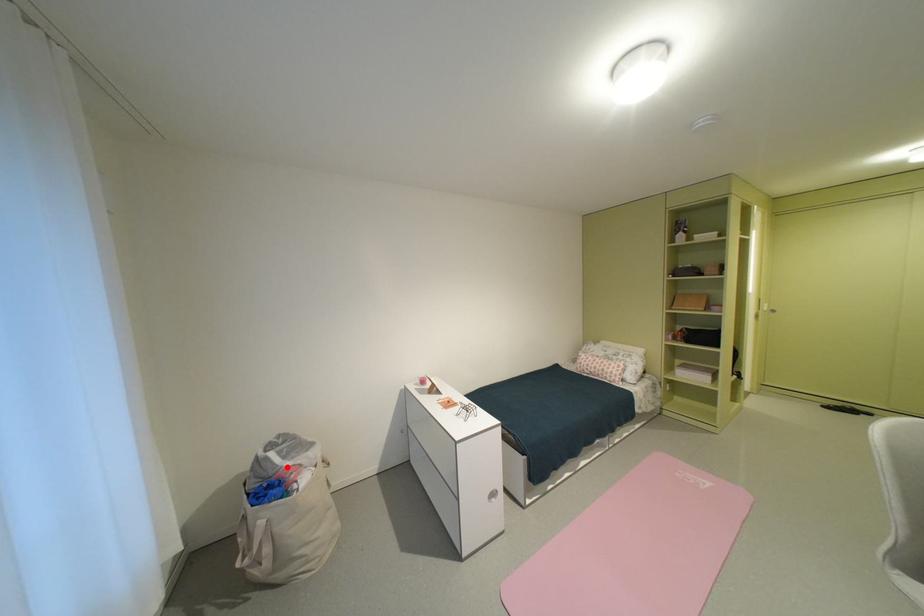
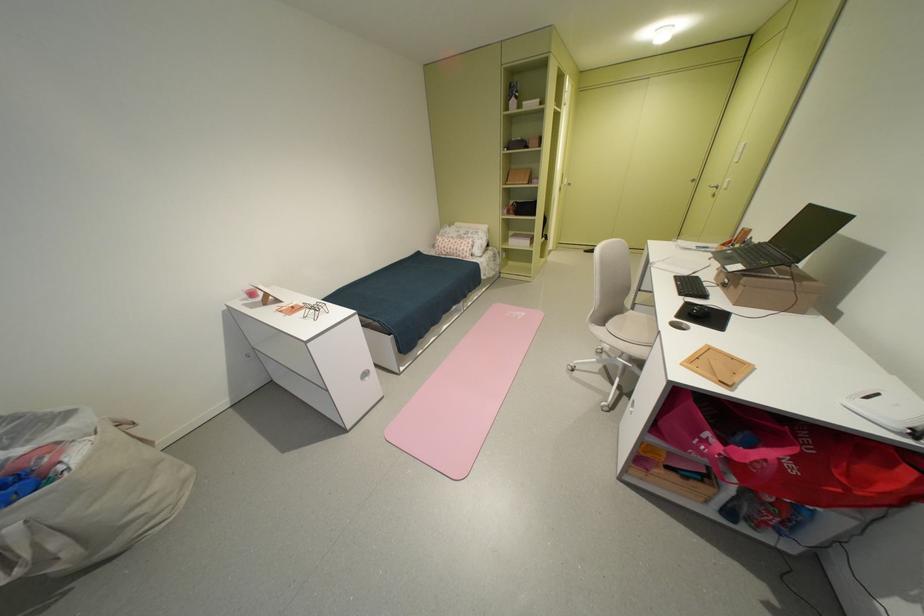
Find the pixel in the second image that matches the highlighted location in the first image.

(6, 463)